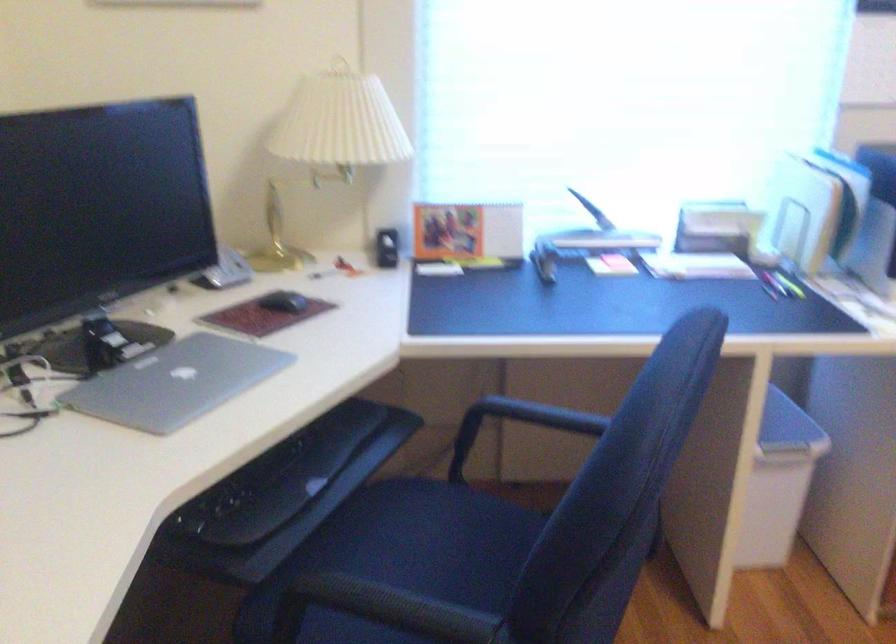
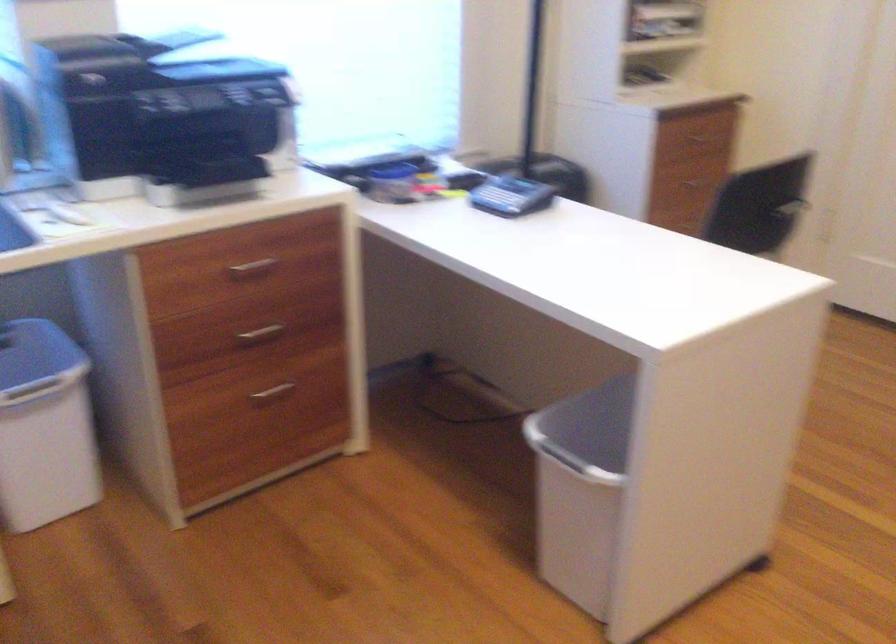
Question: The camera is either moving clockwise (left) or counter-clockwise (right) around the object. The first image is from the beginning of the video and the second image is from the end. Is the camera moving left or right when shooting the video?

Choices:
 (A) Left
 (B) Right

Answer: (A)